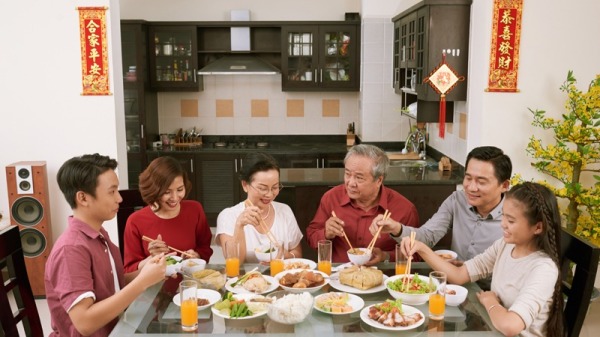
This screenshot has width=600, height=337. Identify the location of chopsticks. (408, 264), (375, 238), (347, 240), (262, 224), (178, 247), (155, 262).